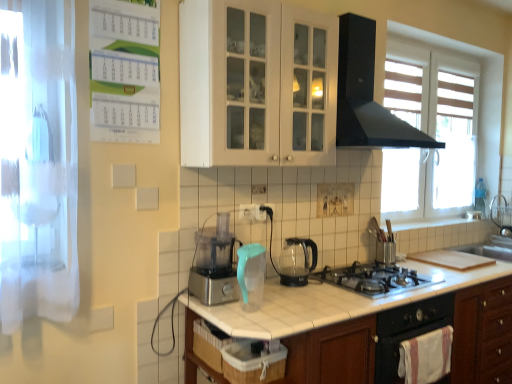
Question: Is transparent fabric screen door at left positioned with its back to black plastic electric outlet at center, positioned as the 2th electric outlet in front-to-back order?

Choices:
 (A) yes
 (B) no

Answer: (B)

Question: Is transparent fabric screen door at left in contact with black plastic electric outlet at center, the second electric outlet from the left?

Choices:
 (A) no
 (B) yes

Answer: (A)

Question: Does transparent fabric screen door at left have a lesser height compared to black plastic electric outlet at center, arranged as the 1th electric outlet when viewed from the right?

Choices:
 (A) yes
 (B) no

Answer: (B)

Question: Considering the relative sizes of transparent fabric screen door at left and black plastic electric outlet at center, positioned as the 2th electric outlet in front-to-back order, in the image provided, is transparent fabric screen door at left taller than black plastic electric outlet at center, positioned as the 2th electric outlet in front-to-back order,?

Choices:
 (A) yes
 (B) no

Answer: (A)

Question: Does transparent fabric screen door at left contain black plastic electric outlet at center, positioned as the 2th electric outlet in front-to-back order?

Choices:
 (A) no
 (B) yes

Answer: (A)

Question: From the image's perspective, is white plastic electric outlet at center, which appears as the second electric outlet when viewed from the back, positioned above or below black matte range hood at upper center?

Choices:
 (A) above
 (B) below

Answer: (B)

Question: In the image, is white plastic electric outlet at center, the 1th electric outlet in the left-to-right sequence, positioned in front of or behind black matte range hood at upper center?

Choices:
 (A) front
 (B) behind

Answer: (B)

Question: Is white plastic electric outlet at center, which is counted as the 1th electric outlet, starting from the front, to the left or to the right of black matte range hood at upper center in the image?

Choices:
 (A) right
 (B) left

Answer: (B)

Question: In terms of size, does white plastic electric outlet at center, which is counted as the 1th electric outlet, starting from the front, appear bigger or smaller than black matte range hood at upper center?

Choices:
 (A) big
 (B) small

Answer: (B)

Question: Considering the positions of white plastic electric outlet at center, which appears as the second electric outlet when viewed from the back, and transparent glass kettle at center in the image, is white plastic electric outlet at center, which appears as the second electric outlet when viewed from the back, taller or shorter than transparent glass kettle at center?

Choices:
 (A) tall
 (B) short

Answer: (B)

Question: Is white plastic electric outlet at center, which appears as the second electric outlet when viewed from the back, to the left or to the right of transparent glass kettle at center in the image?

Choices:
 (A) right
 (B) left

Answer: (B)

Question: Considering the positions of white plastic electric outlet at center, which appears as the second electric outlet when viewed from the back, and transparent glass kettle at center in the image, is white plastic electric outlet at center, which appears as the second electric outlet when viewed from the back, wider or thinner than transparent glass kettle at center?

Choices:
 (A) thin
 (B) wide

Answer: (A)

Question: Considering their positions, is white plastic electric outlet at center, which appears as the second electric outlet when viewed from the back, located in front of or behind transparent glass kettle at center?

Choices:
 (A) behind
 (B) front

Answer: (A)

Question: Based on their sizes in the image, would you say black plastic electric outlet at center, arranged as the 1th electric outlet when viewed from the right, is bigger or smaller than black matte range hood at upper center?

Choices:
 (A) big
 (B) small

Answer: (B)

Question: Is black plastic electric outlet at center, arranged as the 1th electric outlet when viewed from the right, wider or thinner than black matte range hood at upper center?

Choices:
 (A) thin
 (B) wide

Answer: (A)